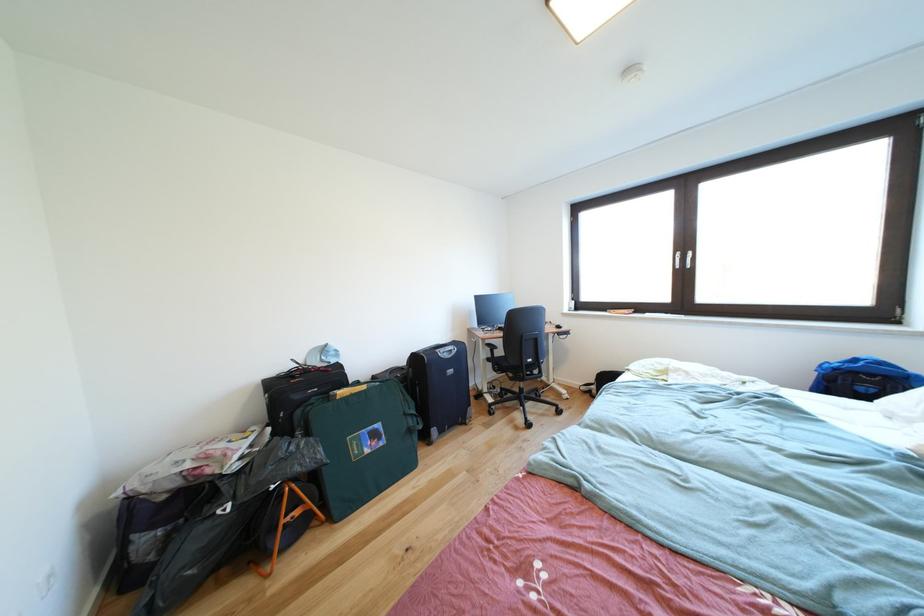
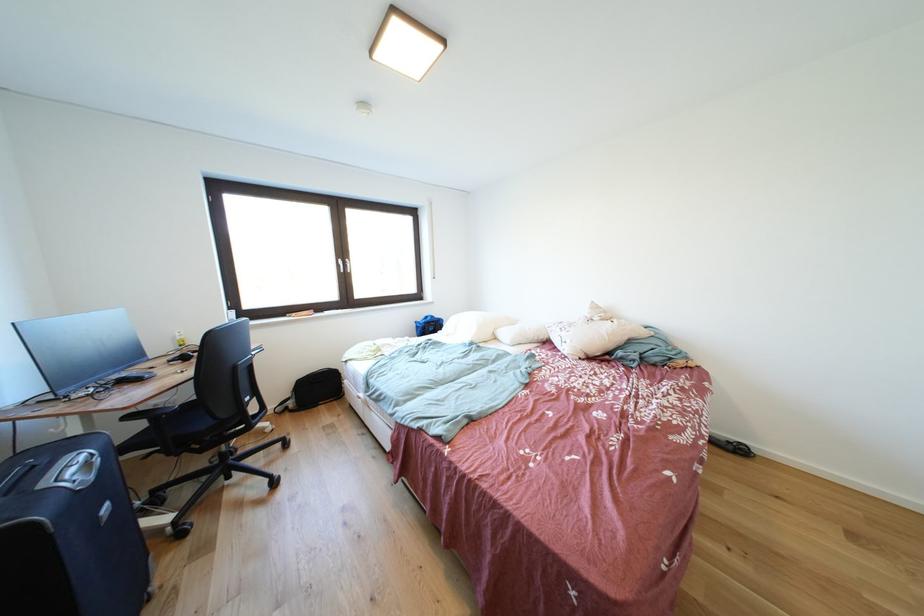
The point at (456,361) is marked in the first image. Where is the corresponding point in the second image?

(101, 483)